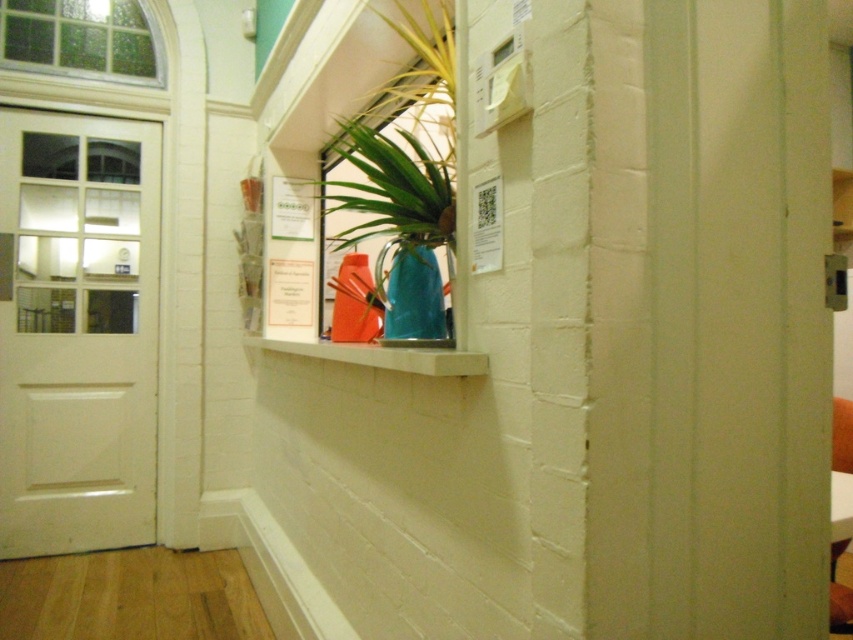
Is white glossy door at left bigger than white concrete shelf at center?

Yes, white glossy door at left is bigger than white concrete shelf at center.

Between white glossy door at left and white concrete shelf at center, which one is positioned lower?

white concrete shelf at center

Is point (48, 547) positioned in front of point (310, 355)?

No, (48, 547) is behind (310, 355).

Find the location of `white glossy door at left`. white glossy door at left is located at coordinates (77, 332).

Does matte blue vase at center have a larger size compared to white concrete shelf at center?

Actually, matte blue vase at center might be smaller than white concrete shelf at center.

Is matte blue vase at center thinner than white concrete shelf at center?

Yes, matte blue vase at center is thinner than white concrete shelf at center.

Between point (427, 317) and point (399, 349), which one is positioned behind?

The point (427, 317) is behind.

Find the location of `matte blue vase at center`. matte blue vase at center is located at coordinates (410, 294).

Between point (67, 4) and point (473, 355), which one is positioned behind?

Positioned behind is point (67, 4).

Is stained glass window at upper left to the left of white concrete shelf at center from the viewer's perspective?

Indeed, stained glass window at upper left is positioned on the left side of white concrete shelf at center.

Is point (135, 72) positioned behind point (466, 352)?

Yes, point (135, 72) is farther from viewer.

Identify the location of stained glass window at upper left. Image resolution: width=853 pixels, height=640 pixels. (78, 36).